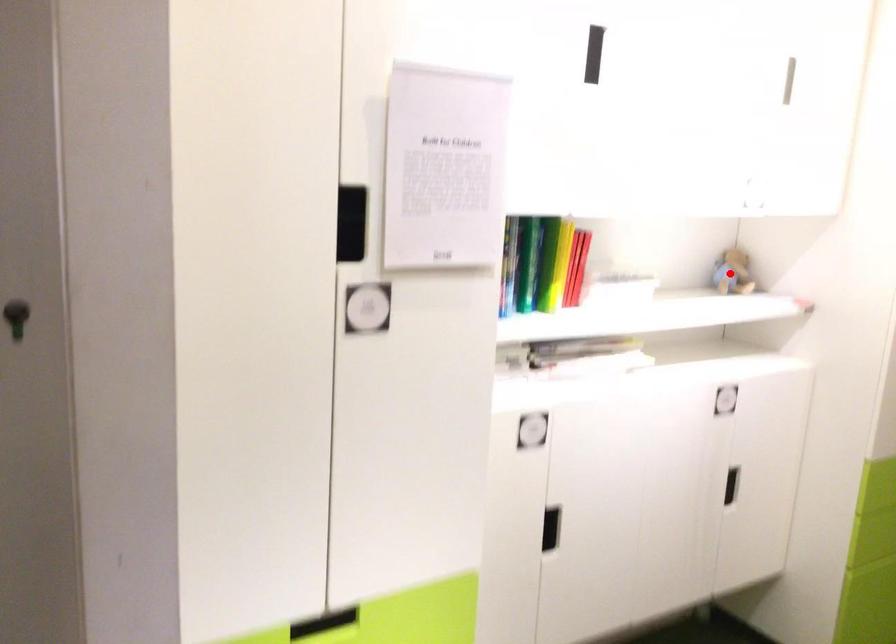
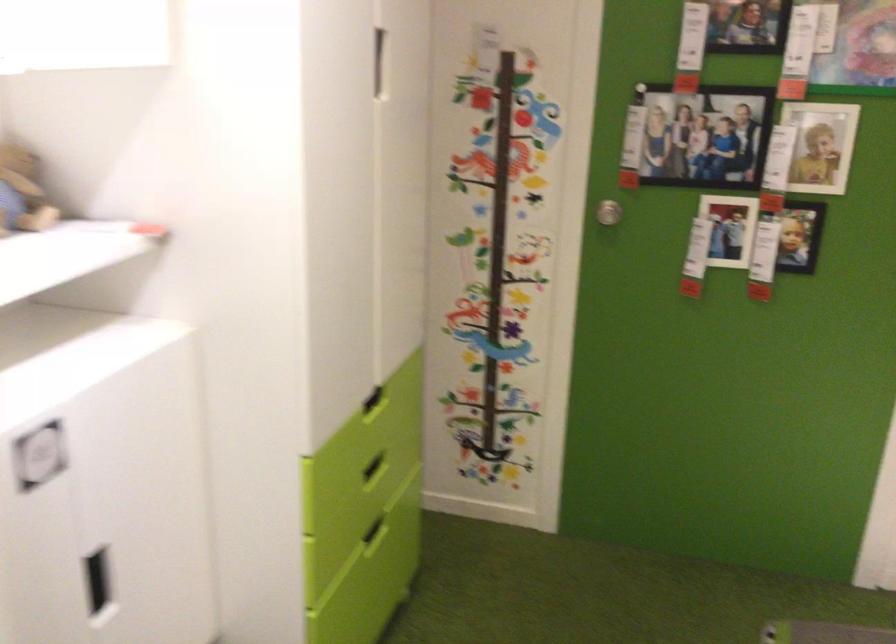
The point at the highlighted location is marked in the first image. Where is the corresponding point in the second image?

(22, 192)